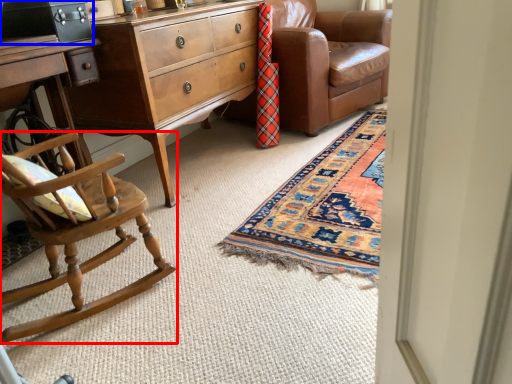
Question: Among these objects, which one is nearest to the camera, chair (highlighted by a red box) or cabinetry (highlighted by a blue box)?

Choices:
 (A) chair
 (B) cabinetry

Answer: (A)